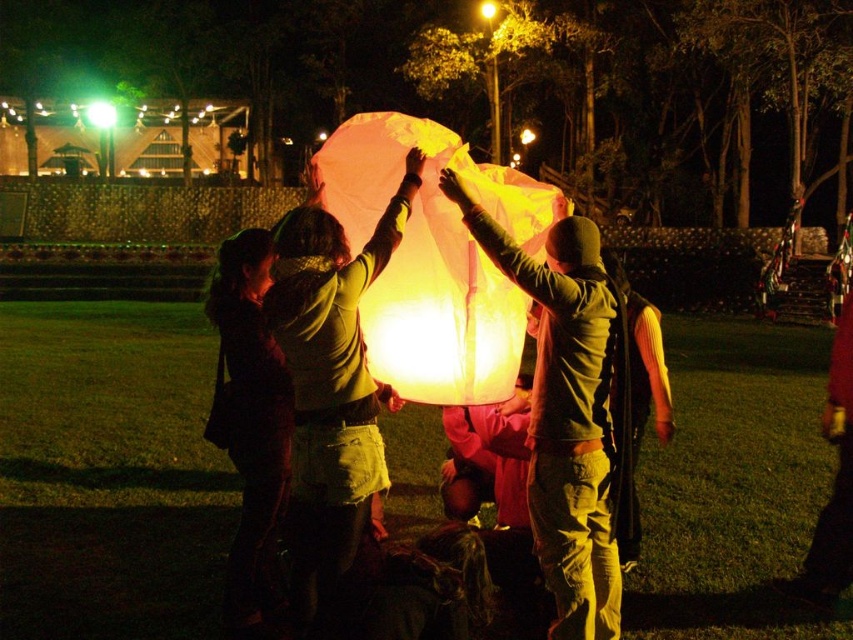
Between translucent paper lantern at center and matte yellow balloon at center, which one appears on the left side from the viewer's perspective?

From the viewer's perspective, translucent paper lantern at center appears more on the left side.

Is point (474, 387) behind point (546, 522)?

Yes, point (474, 387) is farther from viewer.

The image size is (853, 640). Identify the location of translucent paper lantern at center. (434, 259).